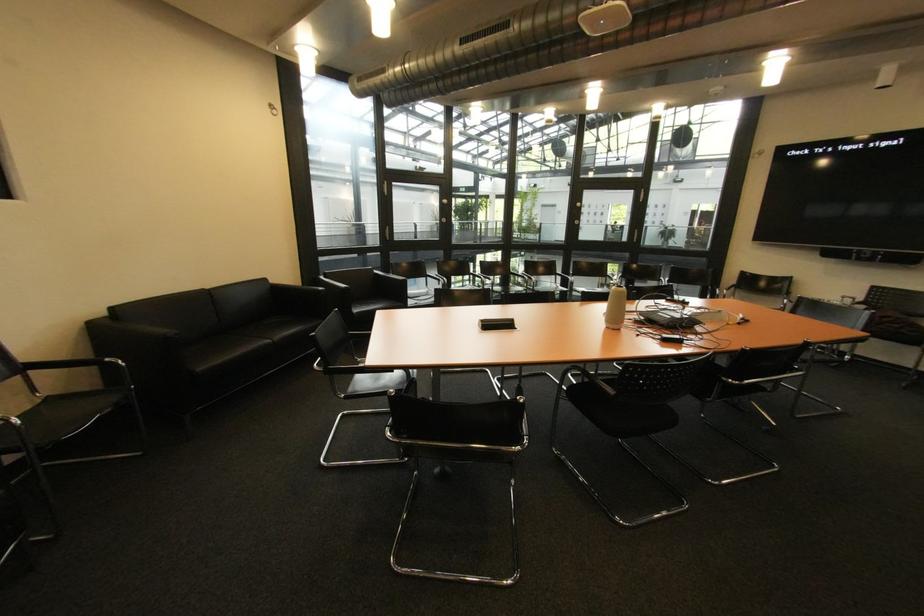
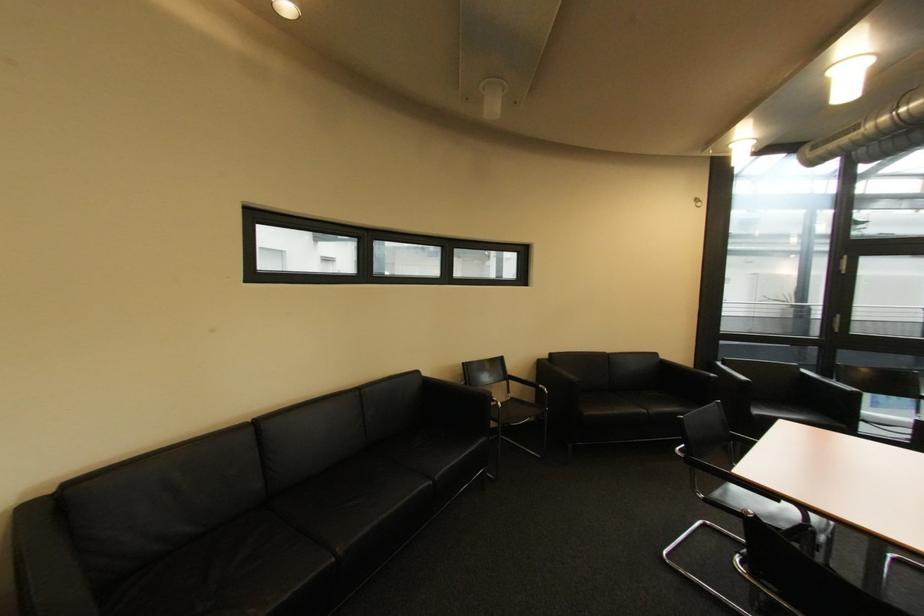
In the second image, find the point that corresponds to the point at 56,400 in the first image.

(520, 400)